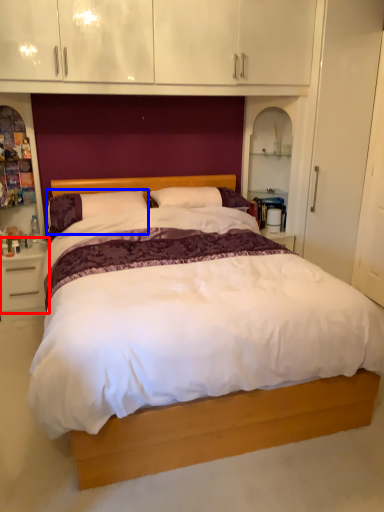
Question: Which of the following is the farthest to the observer, nightstand (highlighted by a red box) or pillow (highlighted by a blue box)?

Choices:
 (A) nightstand
 (B) pillow

Answer: (A)